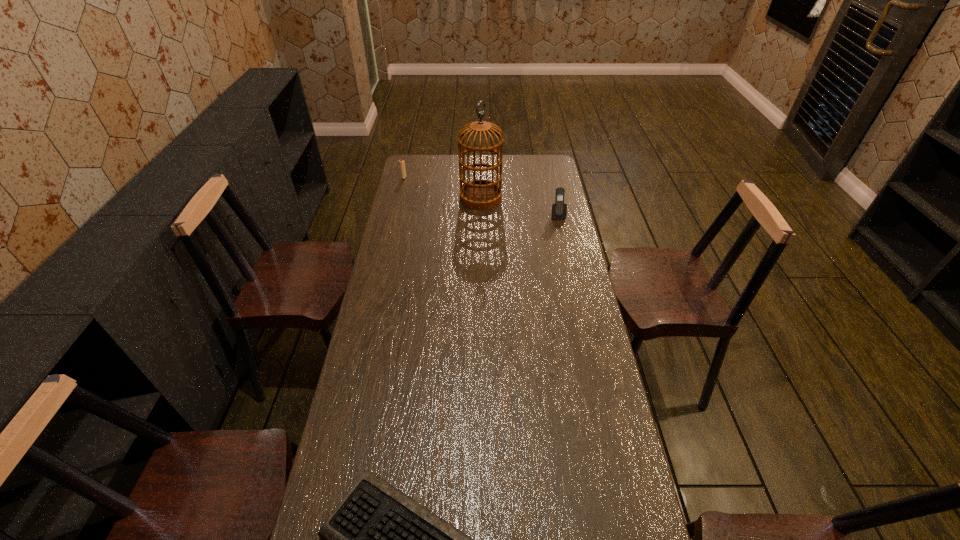
Locate an element on the screen. The image size is (960, 540). the tallest object is located at coordinates (480, 194).

The height and width of the screenshot is (540, 960). What are the coordinates of `birdcage` in the screenshot? It's located at (480, 194).

At what (x,y) coordinates should I click in order to perform the action: click on the rightmost object. Please return your answer as a coordinate pair (x, y). The height and width of the screenshot is (540, 960). Looking at the image, I should click on (559, 210).

Identify the location of cellular telephone. (559, 210).

Locate an element on the screen. The width and height of the screenshot is (960, 540). the third tallest object is located at coordinates (402, 163).

Identify the location of the farthest object. (402, 163).

Find the location of a particular element. free location located 0.290m on the front of the second farthest object is located at coordinates (481, 252).

At what (x,y) coordinates should I click in order to perform the action: click on vacant region located on the front-facing side of the rightmost object. Please return your answer as a coordinate pair (x, y). Looking at the image, I should click on (565, 250).

At what (x,y) coordinates should I click in order to perform the action: click on blank space located on the right of the farthest object. Please return your answer as a coordinate pair (x, y). Image resolution: width=960 pixels, height=540 pixels. Looking at the image, I should click on (443, 178).

At what (x,y) coordinates should I click in order to perform the action: click on object at the far edge. Please return your answer as a coordinate pair (x, y). Image resolution: width=960 pixels, height=540 pixels. Looking at the image, I should click on (402, 163).